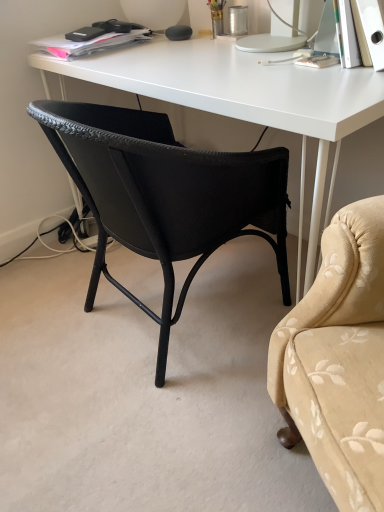
In order to click on vacant space underneath black woven chair at center (from a real-world perspective) in this screenshot , I will do `click(139, 325)`.